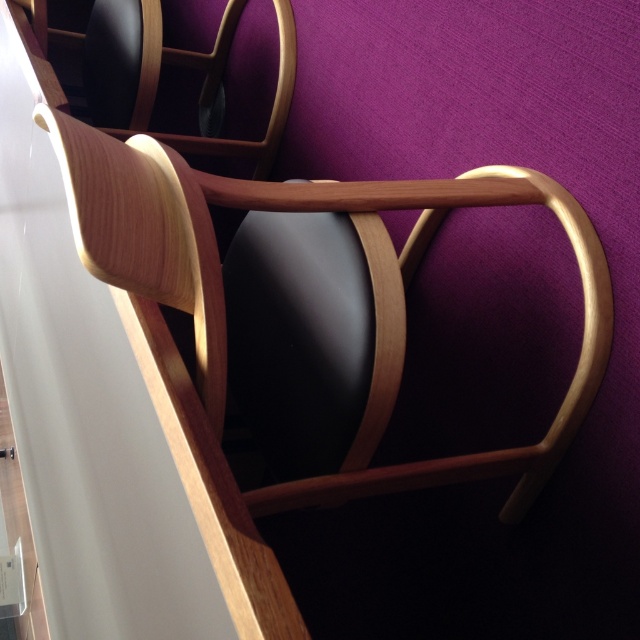
Is white glossy table at left positioned before wooden armchair at center?

Yes.

From the picture: How much distance is there between white glossy table at left and wooden armchair at center?

12.66 inches

Identify the location of white glossy table at left. This screenshot has height=640, width=640. (113, 426).